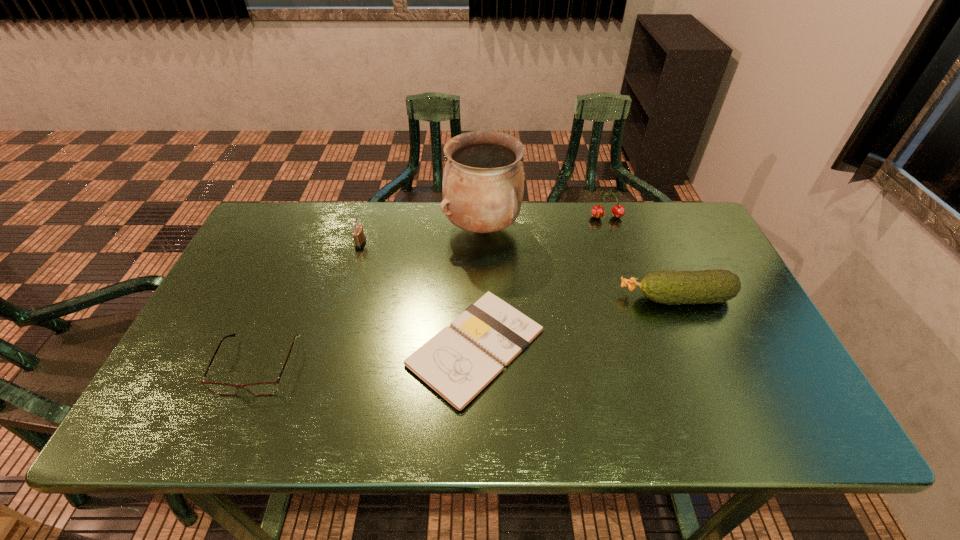
Where is `object situated at the right edge`? The width and height of the screenshot is (960, 540). object situated at the right edge is located at coordinates (668, 287).

Find the location of a particular element. vacant space at the far edge is located at coordinates (393, 228).

This screenshot has width=960, height=540. I want to click on free space at the near edge of the desktop, so click(479, 423).

Find the location of `free space at the left edge of the desktop`. free space at the left edge of the desktop is located at coordinates coord(238,299).

Identify the location of vacant space at the right edge. (732, 372).

Find the location of a particular element. The height and width of the screenshot is (540, 960). vacant space at the far left corner is located at coordinates (276, 237).

The width and height of the screenshot is (960, 540). What are the coordinates of `unoccupied position between the spectacles and the shortest object` in the screenshot? It's located at (367, 356).

Locate an element on the screen. This screenshot has width=960, height=540. vacant space that is in between the second shortest object and the padlock is located at coordinates (309, 305).

Find the location of a particular element. The height and width of the screenshot is (540, 960). vacant space in between the cherry and the cucumber is located at coordinates (641, 258).

I want to click on free spot between the notepad and the cucumber, so click(576, 322).